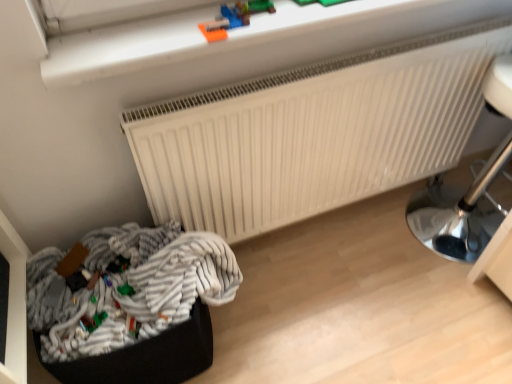
Find the location of a particular element. The height and width of the screenshot is (384, 512). free space on the front side of green matte toy at lower left, which is counted as the second toy, starting from the left is located at coordinates (114, 333).